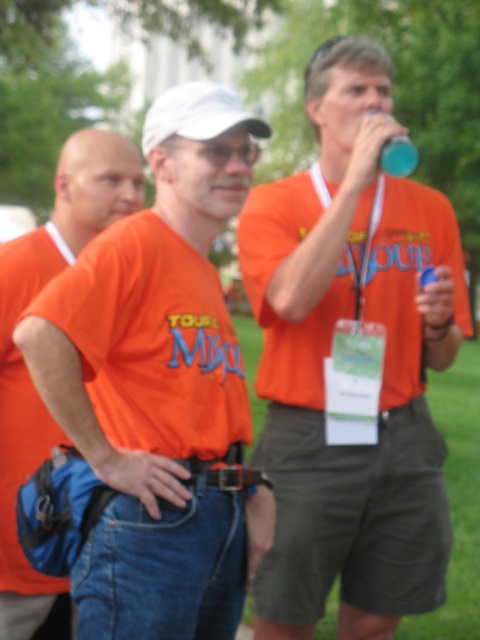
Question: Is orange cotton shirt at center to the right of orange cotton shirt at left from the viewer's perspective?

Choices:
 (A) yes
 (B) no

Answer: (A)

Question: Which point appears farthest from the camera in this image?

Choices:
 (A) (267, 512)
 (B) (332, 92)
 (C) (394, 140)

Answer: (B)

Question: Among these objects, which one is farthest from the camera?

Choices:
 (A) blue plastic cup at upper center
 (B) matte orange shirt at center
 (C) orange cotton shirt at left
 (D) orange cotton shirt at center

Answer: (B)

Question: Among these objects, which one is farthest from the camera?

Choices:
 (A) blue plastic cup at upper center
 (B) orange cotton shirt at center
 (C) orange cotton shirt at left
 (D) matte orange shirt at center

Answer: (D)

Question: Does matte orange shirt at center have a lesser width compared to orange cotton shirt at center?

Choices:
 (A) yes
 (B) no

Answer: (B)

Question: Does orange cotton shirt at center appear on the left side of orange cotton shirt at left?

Choices:
 (A) no
 (B) yes

Answer: (A)